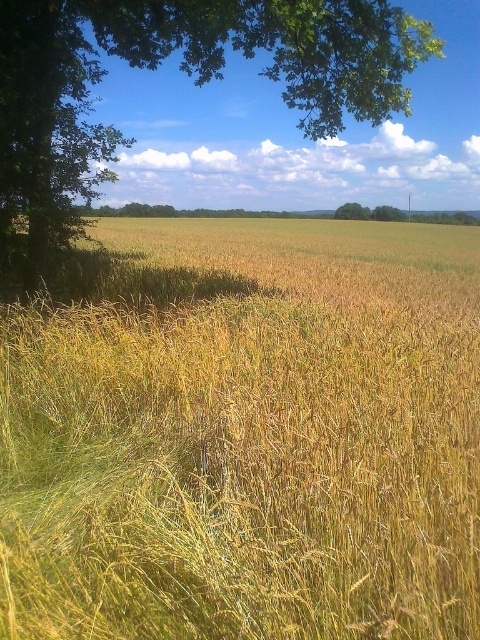
Who is positioned more to the right, yellow grass at center or green leafy tree at upper left?

yellow grass at center is more to the right.

Consider the image. Is yellow grass at center shorter than green leafy tree at upper left?

Yes.

Find the location of a particular element. yellow grass at center is located at coordinates (245, 435).

Find the location of `yellow grass at center`. yellow grass at center is located at coordinates (245, 435).